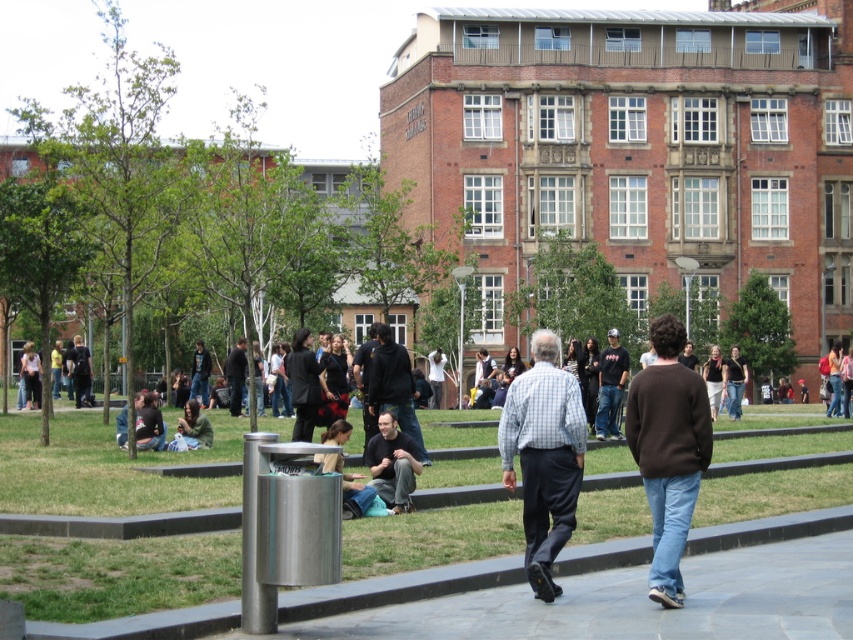
In the scene shown: Can you confirm if dark gray hoodie at center is positioned below dark gray jeans at center?

Incorrect, dark gray hoodie at center is not positioned below dark gray jeans at center.

Between dark gray hoodie at center and dark gray jeans at center, which one is positioned lower?

dark gray jeans at center is below.

Describe the element at coordinates (393, 387) in the screenshot. I see `dark gray hoodie at center` at that location.

Find the location of `dark gray hoodie at center`. dark gray hoodie at center is located at coordinates (393, 387).

Is point (729, 484) positioned behind point (374, 458)?

Yes, point (729, 484) is behind point (374, 458).

Based on the photo, who is more forward, (x=473, y=515) or (x=396, y=426)?

Point (x=473, y=515)

Image resolution: width=853 pixels, height=640 pixels. In order to click on green grass at center in this screenshot , I will do `click(115, 573)`.

Between point (380, 445) and point (610, 401), which one is positioned in front?

Point (380, 445) is more forward.

Between dark gray jeans at center and black t-shirt at center, which one appears on the right side from the viewer's perspective?

Positioned to the right is black t-shirt at center.

Image resolution: width=853 pixels, height=640 pixels. In order to click on dark gray jeans at center in this screenshot , I will do `click(392, 464)`.